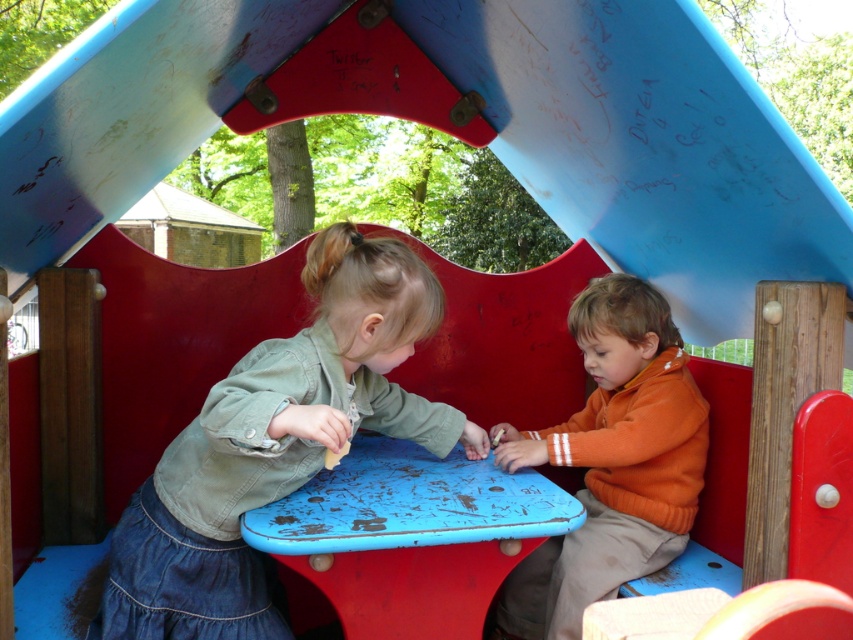
You are a parent trying to locate your child in the playhouse. You see two children wearing the denim jacket at left and the orange fleece sweater at center. Which child is sitting closer to the left side of the table?

The denim jacket at left is to the left of orange fleece sweater at center, so the child wearing the denim jacket at left is sitting closer to the left side of the table.

You are a parent looking for your child wearing a denim jacket at left and an orange fleece sweater at center in the playhouse. Can you see both items at the same time from your current position?

Yes, the denim jacket at left is positioned over the orange fleece sweater at center, so both items are visible from the same vantage point.